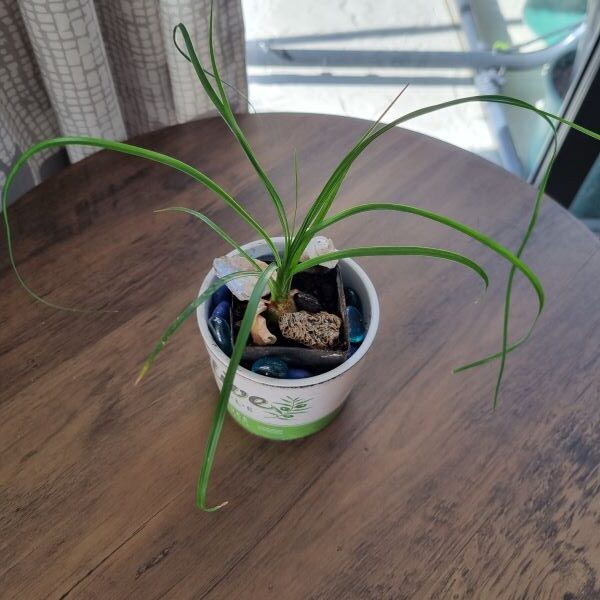
Image resolution: width=600 pixels, height=600 pixels. I want to click on flower pot, so click(301, 400).